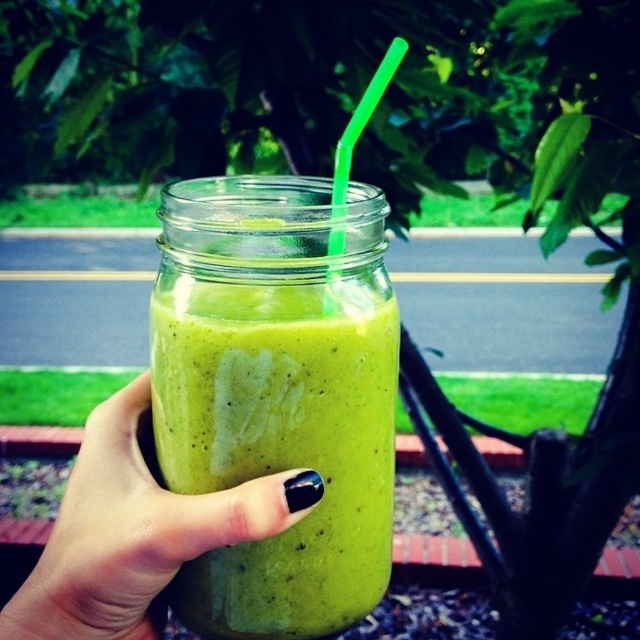
Question: Which point is farther to the camera?

Choices:
 (A) green matte smoothie at center
 (B) green matte glass jar at center

Answer: (B)

Question: Does green matte glass jar at center have a larger size compared to green matte smoothie at center?

Choices:
 (A) no
 (B) yes

Answer: (B)

Question: Can you confirm if green matte glass jar at center is positioned above green matte smoothie at center?

Choices:
 (A) yes
 (B) no

Answer: (A)

Question: Can you confirm if green matte glass jar at center is positioned below green matte smoothie at center?

Choices:
 (A) yes
 (B) no

Answer: (B)